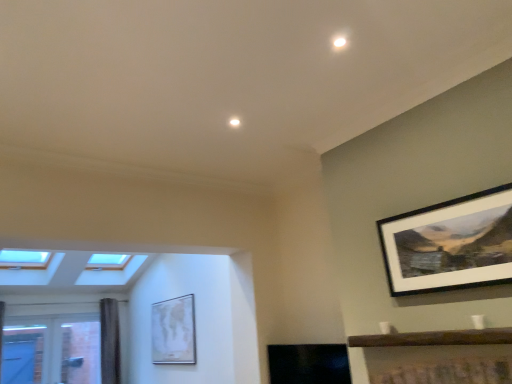
Question: Is wooden shelf at lower right located outside matte white map at center, acting as the second picture frame starting from the front?

Choices:
 (A) no
 (B) yes

Answer: (B)

Question: Is wooden shelf at lower right behind matte white map at center, marked as the 2th picture frame in a right-to-left arrangement?

Choices:
 (A) yes
 (B) no

Answer: (B)

Question: Does wooden shelf at lower right have a larger size compared to matte white map at center, positioned as the first picture frame in left-to-right order?

Choices:
 (A) no
 (B) yes

Answer: (A)

Question: From a real-world perspective, is wooden shelf at lower right physically above matte white map at center, placed as the 1th picture frame when sorted from back to front?

Choices:
 (A) yes
 (B) no

Answer: (B)

Question: Is wooden shelf at lower right facing towards matte white map at center, marked as the 2th picture frame in a right-to-left arrangement?

Choices:
 (A) yes
 (B) no

Answer: (B)

Question: Based on their sizes in the image, would you say matte white map at center, the second picture frame positioned from the top, is bigger or smaller than wooden-framed print at upper right, which is the second picture frame from back to front?

Choices:
 (A) big
 (B) small

Answer: (A)

Question: In terms of height, does matte white map at center, placed as the first picture frame when sorted from bottom to top, look taller or shorter compared to wooden-framed print at upper right, which is the second picture frame from back to front?

Choices:
 (A) tall
 (B) short

Answer: (A)

Question: Relative to wooden-framed print at upper right, arranged as the 2th picture frame when ordered from the bottom, is matte white map at center, marked as the 2th picture frame in a right-to-left arrangement, in front or behind?

Choices:
 (A) front
 (B) behind

Answer: (B)

Question: From a real-world perspective, is matte white map at center, placed as the first picture frame when sorted from bottom to top, positioned above or below wooden-framed print at upper right, the second picture frame viewed from the left?

Choices:
 (A) below
 (B) above

Answer: (A)

Question: Would you say wooden-framed print at upper right, which is the second picture frame from back to front, is inside or outside dark gray textured curtain at left?

Choices:
 (A) inside
 (B) outside

Answer: (B)

Question: From a real-world perspective, is wooden-framed print at upper right, acting as the first picture frame starting from the front, physically located above or below dark gray textured curtain at left?

Choices:
 (A) above
 (B) below

Answer: (A)

Question: In terms of height, does wooden-framed print at upper right, arranged as the 2th picture frame when ordered from the bottom, look taller or shorter compared to dark gray textured curtain at left?

Choices:
 (A) tall
 (B) short

Answer: (B)

Question: Based on their positions, is wooden-framed print at upper right, arranged as the 2th picture frame when ordered from the bottom, located to the left or right of dark gray textured curtain at left?

Choices:
 (A) left
 (B) right

Answer: (B)

Question: Considering their positions, is wooden-framed print at upper right, which is the second picture frame from back to front, located in front of or behind wooden shelf at lower right?

Choices:
 (A) behind
 (B) front

Answer: (A)

Question: From a real-world perspective, is wooden-framed print at upper right, the 1th picture frame in the top-to-bottom sequence, physically located above or below wooden shelf at lower right?

Choices:
 (A) below
 (B) above

Answer: (B)